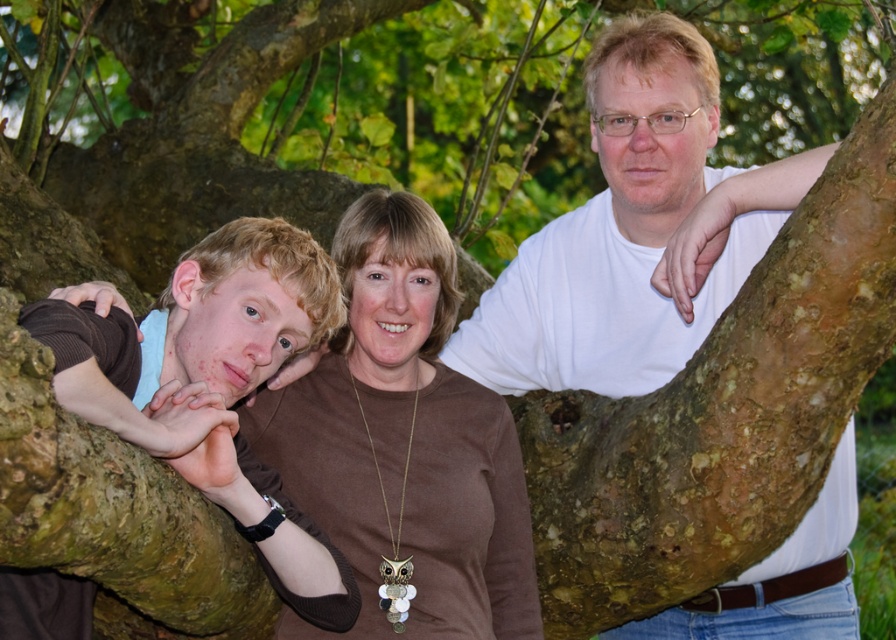
Between point (626, 285) and point (67, 404), which one is positioned behind?

Point (626, 285)

Does white matte shirt at upper center have a greater height compared to brown matte shirt at left?

Yes.

Between point (599, 282) and point (246, 310), which one is positioned behind?

Positioned behind is point (599, 282).

Locate an element on the screen. The image size is (896, 640). white matte shirt at upper center is located at coordinates (634, 230).

Is white matte shirt at upper center further to camera compared to brown matte necklace at center?

No, white matte shirt at upper center is in front of brown matte necklace at center.

Is white matte shirt at upper center smaller than brown matte necklace at center?

Actually, white matte shirt at upper center might be larger than brown matte necklace at center.

You are a GUI agent. You are given a task and a screenshot of the screen. Output one action in this format:
    pyautogui.click(x=<x>, y=<y>)
    Task: Click on the white matte shirt at upper center
    The height and width of the screenshot is (640, 896).
    Given the screenshot: What is the action you would take?
    pyautogui.click(x=634, y=230)

Looking at this image, how distant is brown matte necklace at center from brown matte shirt at left?

brown matte necklace at center is 14.48 inches away from brown matte shirt at left.

What do you see at coordinates (406, 438) in the screenshot? I see `brown matte necklace at center` at bounding box center [406, 438].

Locate an element on the screen. brown matte necklace at center is located at coordinates (406, 438).